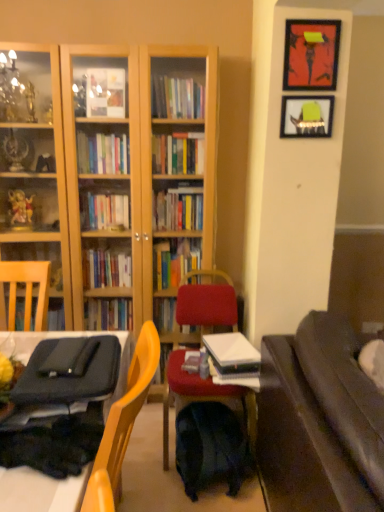
Question: Is dark brown leather couch at right closer to the viewer compared to white paper stack at center?

Choices:
 (A) no
 (B) yes

Answer: (B)

Question: Is dark brown leather couch at right oriented away from white paper stack at center?

Choices:
 (A) no
 (B) yes

Answer: (A)

Question: Would you say dark brown leather couch at right is outside white paper stack at center?

Choices:
 (A) yes
 (B) no

Answer: (A)

Question: Can you confirm if dark brown leather couch at right is smaller than white paper stack at center?

Choices:
 (A) no
 (B) yes

Answer: (A)

Question: Considering the relative sizes of dark brown leather couch at right and white paper stack at center in the image provided, is dark brown leather couch at right wider than white paper stack at center?

Choices:
 (A) yes
 (B) no

Answer: (A)

Question: Can you confirm if dark brown leather couch at right is shorter than white paper stack at center?

Choices:
 (A) no
 (B) yes

Answer: (A)

Question: Is velvet red chair at center not inside matte green picture frame at upper right, arranged as the second picture frame when viewed from the top?

Choices:
 (A) no
 (B) yes

Answer: (B)

Question: From the image's perspective, would you say velvet red chair at center is shown under matte green picture frame at upper right, arranged as the second picture frame when viewed from the top?

Choices:
 (A) no
 (B) yes

Answer: (B)

Question: Are velvet red chair at center and matte green picture frame at upper right, which is the first picture frame from bottom to top, far apart?

Choices:
 (A) no
 (B) yes

Answer: (B)

Question: Considering the relative sizes of velvet red chair at center and matte green picture frame at upper right, arranged as the second picture frame when viewed from the top, in the image provided, is velvet red chair at center wider than matte green picture frame at upper right, arranged as the second picture frame when viewed from the top,?

Choices:
 (A) no
 (B) yes

Answer: (B)

Question: Does velvet red chair at center have a greater height compared to matte green picture frame at upper right, which is the first picture frame from bottom to top?

Choices:
 (A) no
 (B) yes

Answer: (B)

Question: Is velvet red chair at center at the left side of matte green picture frame at upper right, which is the first picture frame from bottom to top?

Choices:
 (A) no
 (B) yes

Answer: (B)

Question: From a real-world perspective, is metallic framed artwork at upper right, marked as the second picture frame in a bottom-to-top arrangement, positioned under matte green picture frame at upper right, which is the first picture frame from bottom to top, based on gravity?

Choices:
 (A) yes
 (B) no

Answer: (B)